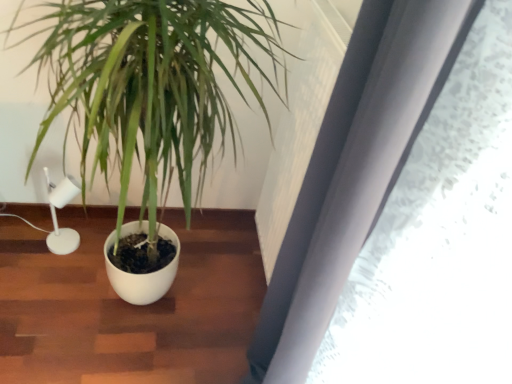
The height and width of the screenshot is (384, 512). I want to click on blank area beneath green matte plant at center (from a real-world perspective), so click(155, 301).